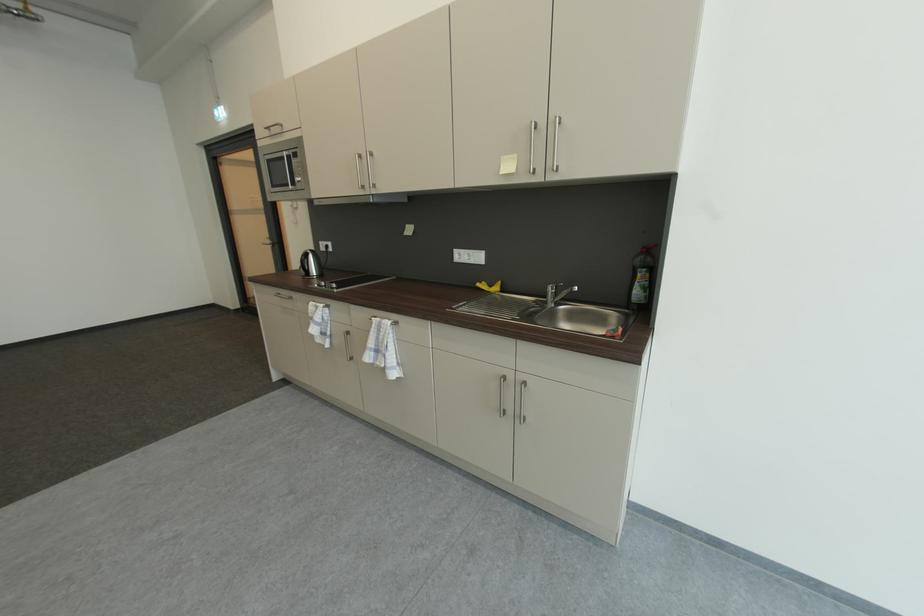
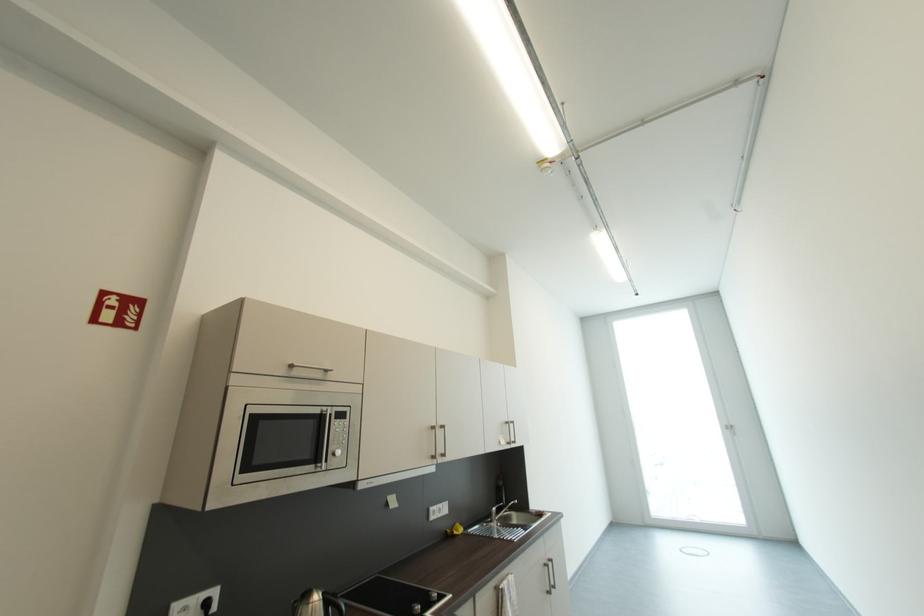
Find the pixel in the second image that matches point 511,379 in the first image.

(552, 567)